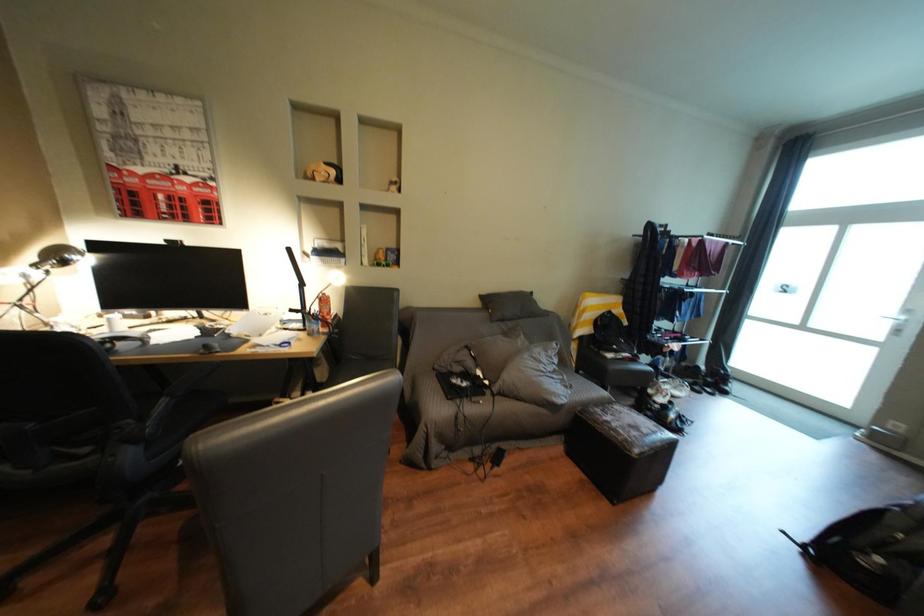
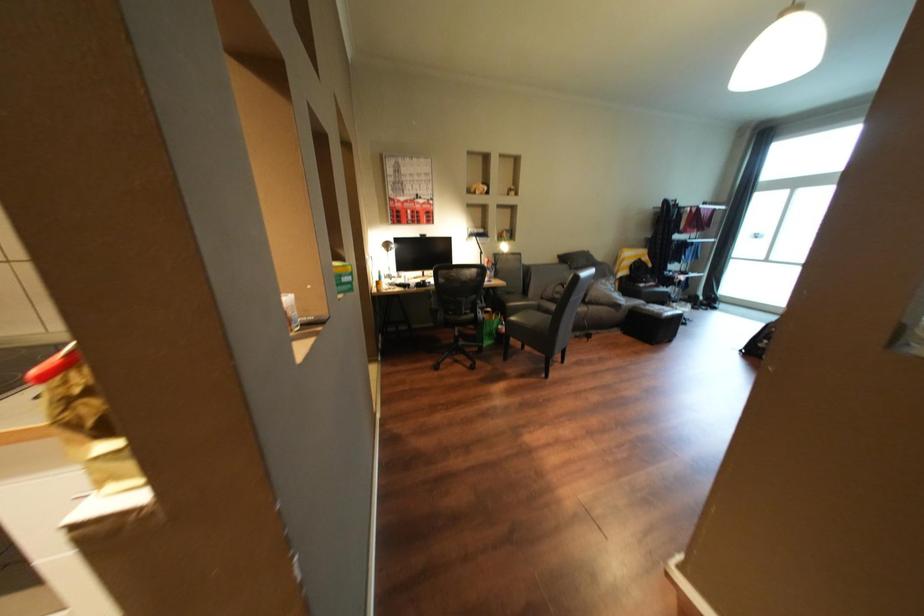
In a continuous first-person perspective shot, in which direction is the camera moving?

The cameraman moved toward left, backward.